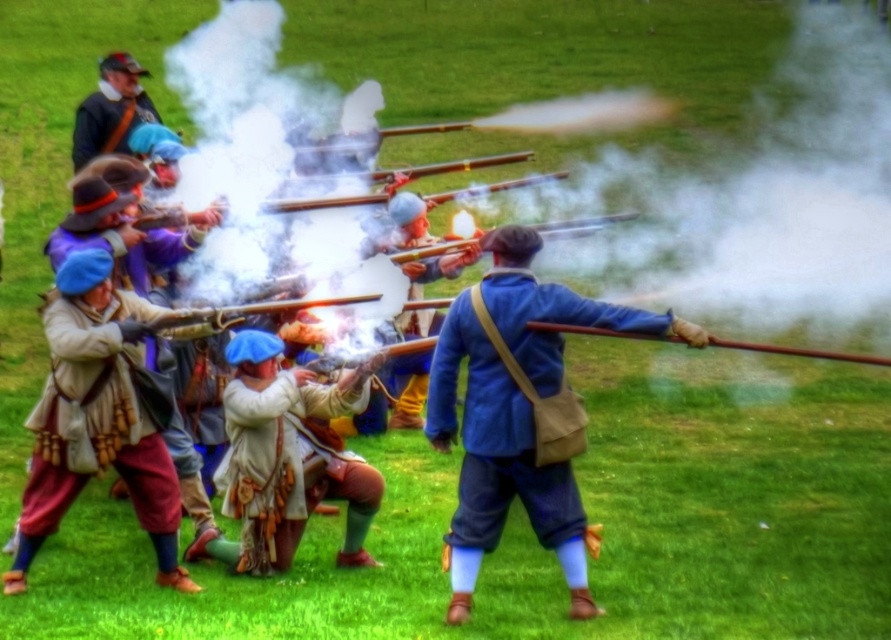
Between matte brown leather hat at upper left and wooden smooth rifle at center, which one is positioned higher?

Positioned higher is matte brown leather hat at upper left.

Between point (74, 120) and point (741, 340), which one is positioned in front?

Point (741, 340) is in front.

This screenshot has width=891, height=640. What are the coordinates of `matte brown leather hat at upper left` in the screenshot? It's located at (111, 109).

Which is more to the left, blue fabric coat at center or wooden smooth rifle at center?

Positioned to the left is blue fabric coat at center.

Between blue fabric coat at center and wooden smooth rifle at center, which one has more height?

blue fabric coat at center is taller.

This screenshot has height=640, width=891. Identify the location of blue fabric coat at center. (518, 412).

Can you confirm if wooden smooth gun at center is positioned to the right of wooden smooth rifle at center?

Incorrect, wooden smooth gun at center is not on the right side of wooden smooth rifle at center.

Which is in front, point (197, 333) or point (652, 337)?

Point (652, 337) is in front.

The height and width of the screenshot is (640, 891). What do you see at coordinates (244, 314) in the screenshot?
I see `wooden smooth gun at center` at bounding box center [244, 314].

At what (x,y) coordinates should I click in order to perform the action: click on wooden smooth gun at center. Please return your answer as a coordinate pair (x, y). Looking at the image, I should click on pyautogui.click(x=244, y=314).